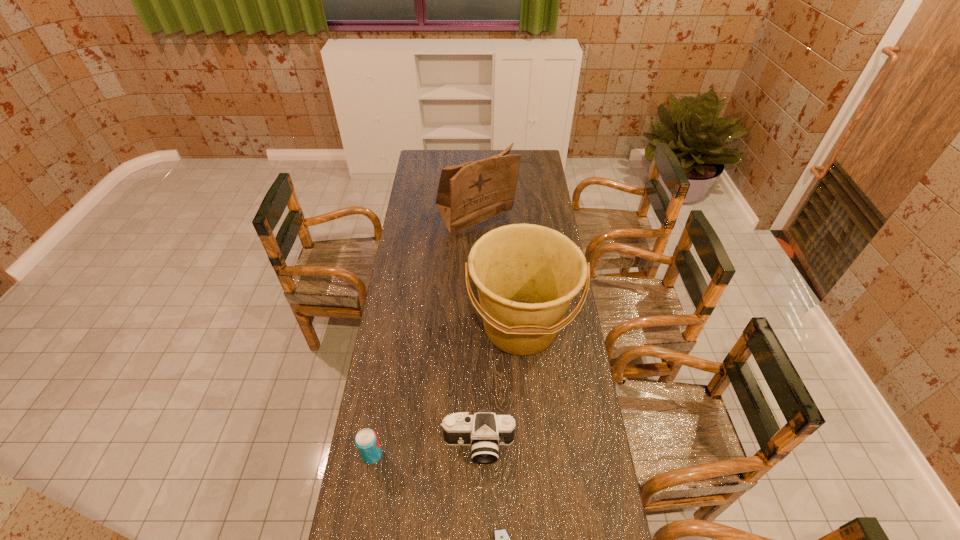
Where is `grocery bag that is at the left edge`? This screenshot has height=540, width=960. grocery bag that is at the left edge is located at coordinates (468, 194).

At what (x,y) coordinates should I click in order to perform the action: click on soda can situated at the left edge. Please return your answer as a coordinate pair (x, y). The image size is (960, 540). Looking at the image, I should click on click(366, 440).

The width and height of the screenshot is (960, 540). Identify the location of object present at the right edge. (526, 275).

In the image, there is a desktop. Identify the location of free space at the far edge. The width and height of the screenshot is (960, 540). (489, 153).

In the image, there is a desktop. Identify the location of vacant space at the left edge. (430, 211).

The height and width of the screenshot is (540, 960). I want to click on vacant space at the right edge of the desktop, so click(x=538, y=205).

This screenshot has width=960, height=540. I want to click on free space between the grocery bag and the soda can, so click(x=424, y=339).

Find the location of a particular element. The width and height of the screenshot is (960, 540). vacant space in between the farthest object and the soda can is located at coordinates (424, 339).

Find the location of a particular element. Image resolution: width=960 pixels, height=540 pixels. vacant area that lies between the leftmost object and the farthest object is located at coordinates (424, 339).

Locate an element on the screen. The height and width of the screenshot is (540, 960). vacant point located between the camera and the leftmost object is located at coordinates (425, 450).